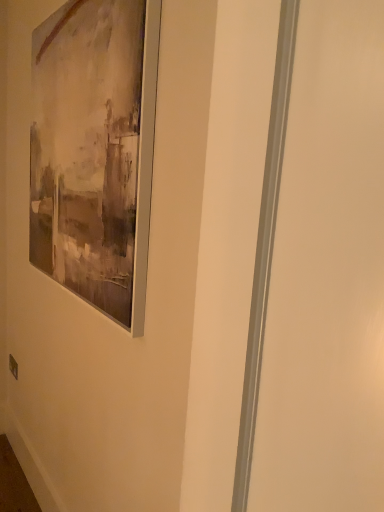
In order to face matte plastic outlet at lower left, should I rotate leftwards or rightwards?

To align with it, rotate left about 22.677°.

What is the approximate width of matte plastic outlet at lower left?

matte plastic outlet at lower left is 1.06 centimeters wide.

This screenshot has height=512, width=384. Describe the element at coordinates (13, 366) in the screenshot. I see `matte plastic outlet at lower left` at that location.

Find the location of a particular element. This screenshot has height=512, width=384. matte plastic outlet at lower left is located at coordinates (13, 366).

What do you see at coordinates (95, 150) in the screenshot?
I see `matte brown frame at upper left` at bounding box center [95, 150].

Locate an element on the screen. This screenshot has width=384, height=512. matte brown frame at upper left is located at coordinates (95, 150).

Locate an element on the screen. matte plastic outlet at lower left is located at coordinates (13, 366).

Is matte brown frame at upper left to the left or to the right of matte plastic outlet at lower left in the image?

matte brown frame at upper left is positioned on matte plastic outlet at lower left's right side.

Is matte brown frame at upper left in front of or behind matte plastic outlet at lower left in the image?

matte brown frame at upper left is positioned closer to the viewer than matte plastic outlet at lower left.

Which is closer to the camera, (60,52) or (16,365)?

Point (60,52) is closer to the camera than point (16,365).

From the image's perspective, is matte brown frame at upper left located above or below matte plastic outlet at lower left?

Based on their image positions, matte brown frame at upper left is located above matte plastic outlet at lower left.

From a real-world perspective, is matte brown frame at upper left located higher than matte plastic outlet at lower left?

Yes, from a real-world perspective, matte brown frame at upper left is over matte plastic outlet at lower left

Which of these two, matte brown frame at upper left or matte plastic outlet at lower left, is thinner?

Thinner between the two is matte plastic outlet at lower left.

From the picture: Can you confirm if matte brown frame at upper left is shorter than matte plastic outlet at lower left?

No, matte brown frame at upper left is not shorter than matte plastic outlet at lower left.

Considering the sizes of objects matte brown frame at upper left and matte plastic outlet at lower left in the image provided, who is smaller, matte brown frame at upper left or matte plastic outlet at lower left?

Smaller between the two is matte plastic outlet at lower left.

Can matte plastic outlet at lower left be found inside matte brown frame at upper left?

No, matte plastic outlet at lower left is not a part of matte brown frame at upper left.

Consider the image. Is the surface of matte brown frame at upper left in direct contact with matte plastic outlet at lower left?

No, matte brown frame at upper left is not in contact with matte plastic outlet at lower left.

Could you tell me if matte brown frame at upper left is facing matte plastic outlet at lower left?

No, matte brown frame at upper left is not turned towards matte plastic outlet at lower left.

Find the location of `electric outlet to the left of matte brown frame at upper left`. electric outlet to the left of matte brown frame at upper left is located at coordinates (13, 366).

Is matte plastic outlet at lower left to the left of matte brown frame at upper left from the viewer's perspective?

Yes, matte plastic outlet at lower left is to the left of matte brown frame at upper left.

Considering their positions, is matte plastic outlet at lower left located in front of or behind matte brown frame at upper left?

matte plastic outlet at lower left is behind matte brown frame at upper left.

Is point (10, 368) closer to camera compared to point (60, 192)?

No.

From the image's perspective, is matte plastic outlet at lower left over matte brown frame at upper left?

Incorrect, from the image's perspective, matte plastic outlet at lower left is lower than matte brown frame at upper left.

From a real-world perspective, is matte plastic outlet at lower left above or below matte brown frame at upper left?

matte plastic outlet at lower left is situated lower than matte brown frame at upper left in the real world.

Which object is thinner, matte plastic outlet at lower left or matte brown frame at upper left?

With smaller width is matte plastic outlet at lower left.

Considering the relative sizes of matte plastic outlet at lower left and matte brown frame at upper left in the image provided, is matte plastic outlet at lower left taller than matte brown frame at upper left?

No.

Does matte plastic outlet at lower left have a larger size compared to matte brown frame at upper left?

No, matte plastic outlet at lower left is not bigger than matte brown frame at upper left.

Is matte plastic outlet at lower left located outside matte brown frame at upper left?

matte plastic outlet at lower left is positioned outside matte brown frame at upper left.

Looking at this image, is the surface of matte plastic outlet at lower left in direct contact with matte brown frame at upper left?

No, matte plastic outlet at lower left is not with matte brown frame at upper left.

Is matte plastic outlet at lower left turned away from matte brown frame at upper left?

No, matte plastic outlet at lower left is not facing the opposite direction of matte brown frame at upper left.

Can you tell me how much matte plastic outlet at lower left and matte brown frame at upper left differ in facing direction?

0.0501 degrees.

How distant is matte plastic outlet at lower left from matte brown frame at upper left?

matte plastic outlet at lower left is 1.44 meters away from matte brown frame at upper left.

Image resolution: width=384 pixels, height=512 pixels. What are the coordinates of `electric outlet on the left side of matte brown frame at upper left` in the screenshot? It's located at (13, 366).

I want to click on electric outlet on the left side of matte brown frame at upper left, so click(x=13, y=366).

Locate an element on the screen. This screenshot has width=384, height=512. electric outlet that is behind the matte brown frame at upper left is located at coordinates (13, 366).